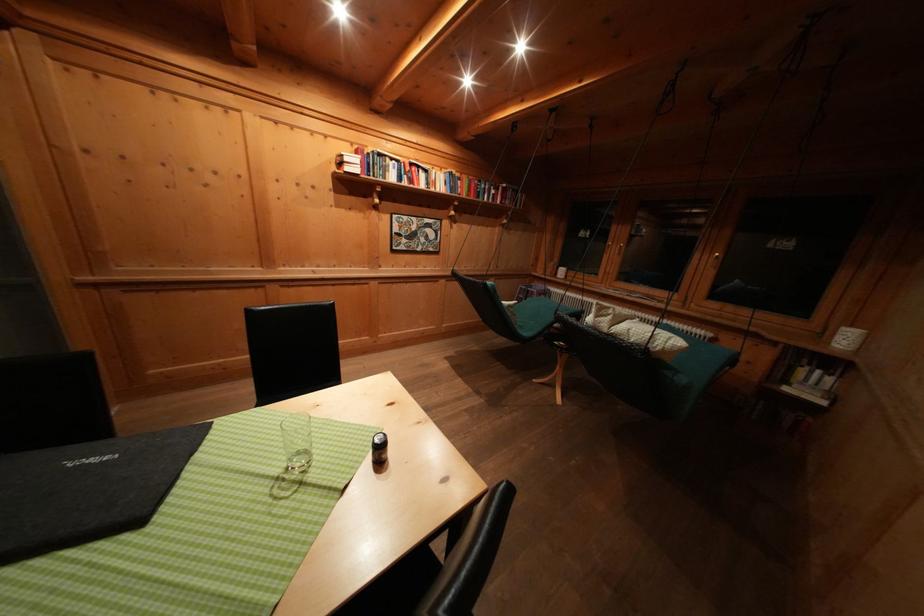
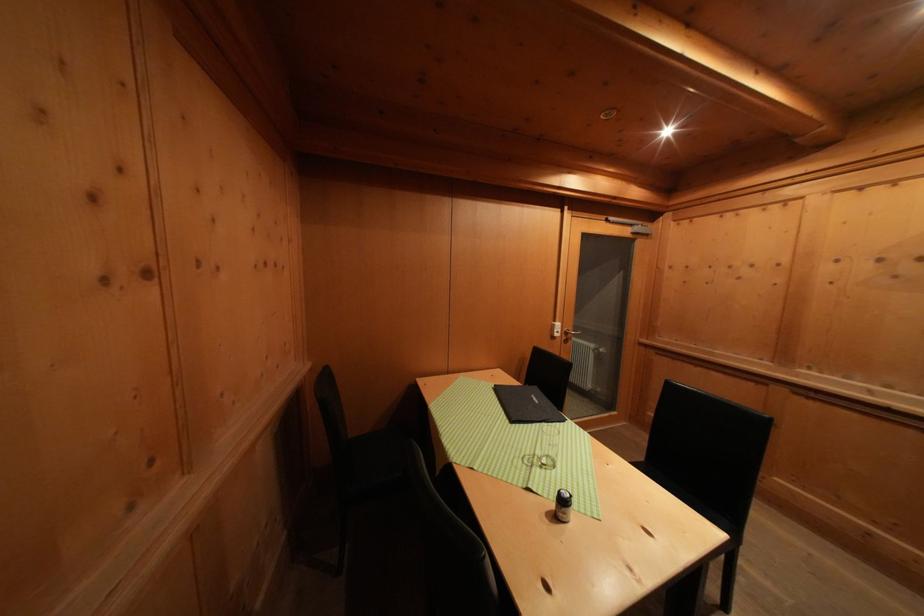
Find the pixel in the second image that matches point (195, 472) in the first image.

(543, 429)